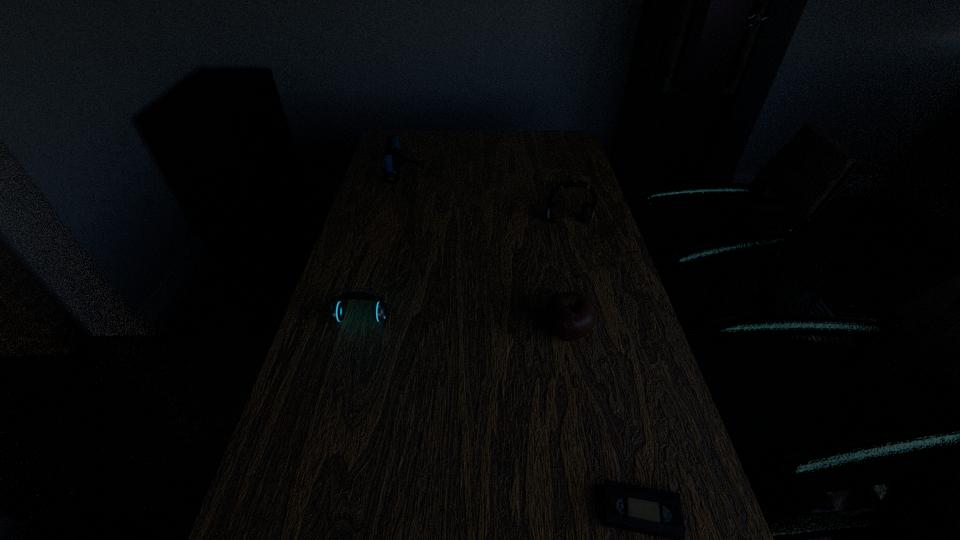
This screenshot has height=540, width=960. Identify the location of unoccupied area between the second farthest object and the shortest headset. (465, 271).

Locate an element on the screen. vacant point located between the farthest object and the nearest headset is located at coordinates (383, 247).

This screenshot has width=960, height=540. Find the location of `object that can be found as the third closest to the shortest object`. object that can be found as the third closest to the shortest object is located at coordinates (x=587, y=212).

Point out which object is positioned as the fourth nearest to the second farthest headset. Please provide its 2D coordinates. Your answer should be formatted as a tuple, i.e. [(x, y)], where the tuple contains the x and y coordinates of a point satisfying the conditions above.

[(655, 512)]

What are the coordinates of `headset that is the second closest to the fourth nearest object` in the screenshot? It's located at (337, 310).

Point out which headset is positioned as the nearest to the farthest object. Please provide its 2D coordinates. Your answer should be formatted as a tuple, i.e. [(x, y)], where the tuple contains the x and y coordinates of a point satisfying the conditions above.

[(587, 212)]

Find the location of `vacant space that satisfies the following two spatial constraints: 1. with the microphone attached to the side of the farthest headset; 2. on the ear cups of the nearest headset`. vacant space that satisfies the following two spatial constraints: 1. with the microphone attached to the side of the farthest headset; 2. on the ear cups of the nearest headset is located at coordinates (372, 319).

Where is `vacant space that satisfies the following two spatial constraints: 1. with the microphone attached to the side of the farthest object; 2. on the ear cups of the nearest headset`? Image resolution: width=960 pixels, height=540 pixels. vacant space that satisfies the following two spatial constraints: 1. with the microphone attached to the side of the farthest object; 2. on the ear cups of the nearest headset is located at coordinates (372, 319).

In order to click on free location that satisfies the following two spatial constraints: 1. on the ear cup of the rightmost headset; 2. on the side of the apple with the unique marking in this screenshot , I will do `click(595, 332)`.